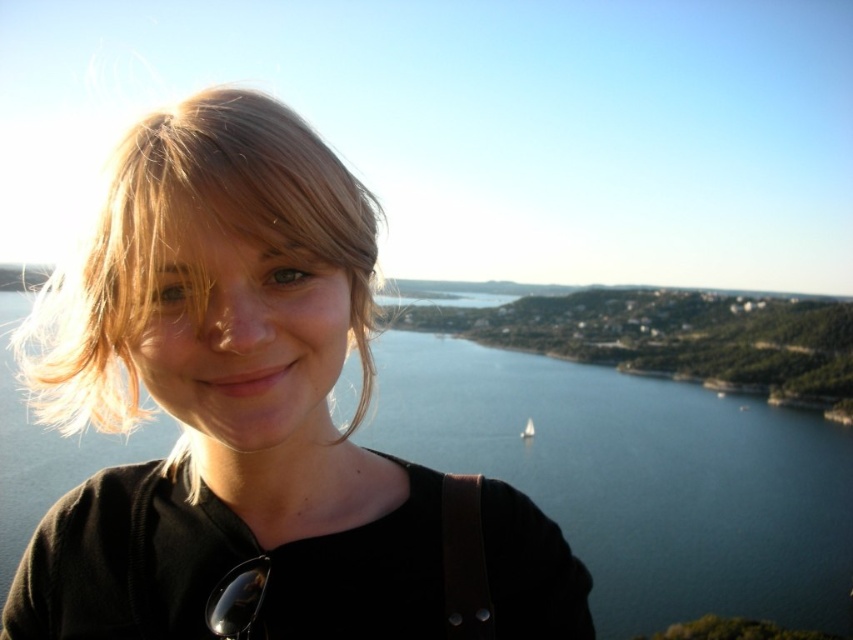
Question: Which object is closer to the camera taking this photo?

Choices:
 (A) matte black hair at upper left
 (B) white sailboat at center

Answer: (A)

Question: Can you confirm if matte black hair at upper left is positioned to the right of blonde hair at left?

Choices:
 (A) no
 (B) yes

Answer: (B)

Question: Can you confirm if matte black hair at upper left is positioned to the right of blonde hair at left?

Choices:
 (A) yes
 (B) no

Answer: (A)

Question: Estimate the real-world distances between objects in this image. Which object is closer to the matte black hair at upper left?

Choices:
 (A) blonde hair at left
 (B) white sailboat at center

Answer: (A)

Question: Estimate the real-world distances between objects in this image. Which object is closer to the matte black hair at upper left?

Choices:
 (A) blonde hair at left
 (B) white sailboat at center

Answer: (A)

Question: Does matte black hair at upper left have a smaller size compared to blonde hair at left?

Choices:
 (A) yes
 (B) no

Answer: (A)